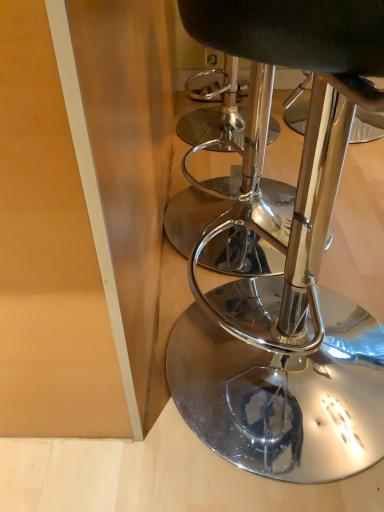
This screenshot has height=512, width=384. What do you see at coordinates (284, 256) in the screenshot?
I see `polished chrome stool at center` at bounding box center [284, 256].

What is the approximate height of polished chrome stool at center?

The height of polished chrome stool at center is 69.02 centimeters.

Identify the location of polished chrome stool at center. Image resolution: width=384 pixels, height=512 pixels. (284, 256).

In order to face polished chrome stool at center, should I rotate leftwards or rightwards?

Turn right by 16.074 degrees to look at polished chrome stool at center.

Image resolution: width=384 pixels, height=512 pixels. What are the coordinates of `polished chrome stool at center` in the screenshot? It's located at (284, 256).